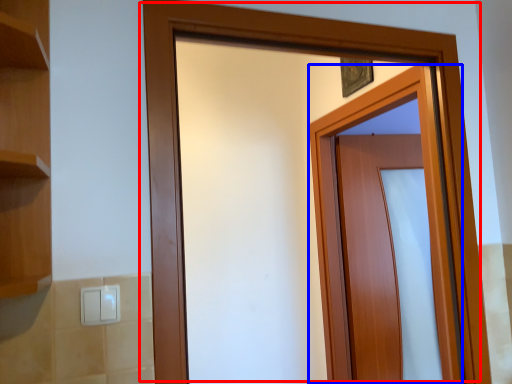
Question: Which point is closer to the camera, door (highlighted by a red box) or door (highlighted by a blue box)?

Choices:
 (A) door
 (B) door

Answer: (A)